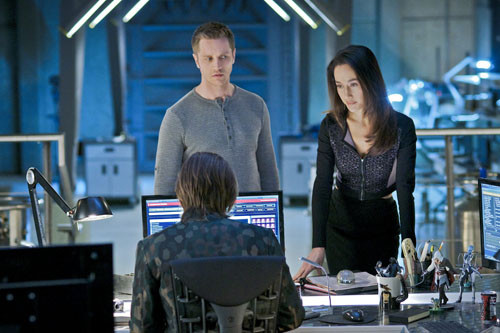
The image size is (500, 333). Find the location of `slots/shelves in a wall`. slots/shelves in a wall is located at coordinates (166, 24), (160, 52), (159, 81), (156, 108), (150, 135).